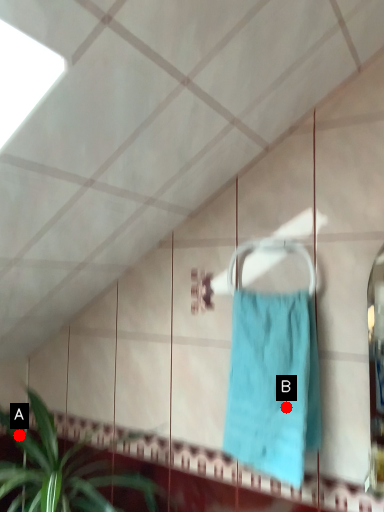
Question: Two points are circled on the image, labeled by A and B beside each circle. Which point is farther to the camera?

Choices:
 (A) A is further
 (B) B is further

Answer: (A)